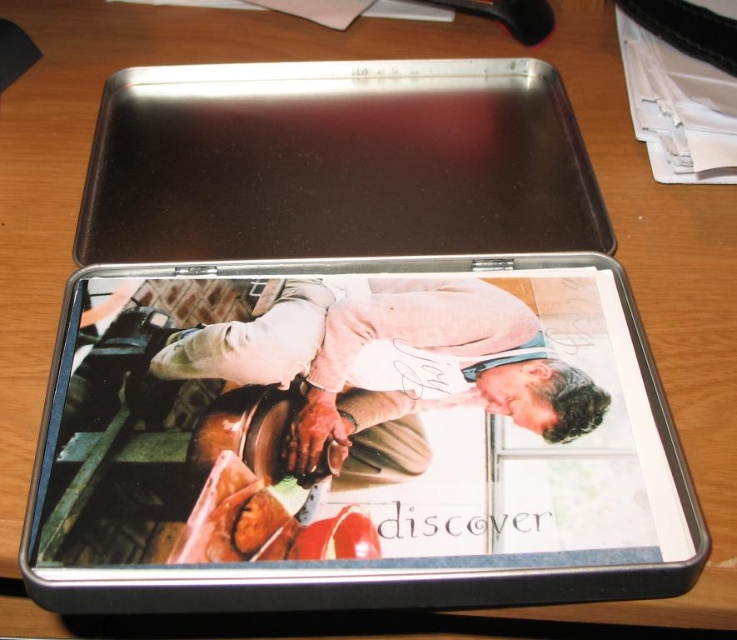
Question: Which object appears closest to the camera in this image?

Choices:
 (A) matte beige sweater at center
 (B) metallic silver tablet at center

Answer: (B)

Question: Can you confirm if metallic silver tablet at center is bigger than metallic silver tray at center?

Choices:
 (A) no
 (B) yes

Answer: (A)

Question: Is metallic silver tablet at center wider than matte beige sweater at center?

Choices:
 (A) yes
 (B) no

Answer: (A)

Question: Which of the following is the farthest from the observer?

Choices:
 (A) (618, 269)
 (B) (517, 364)
 (C) (304, 100)

Answer: (C)

Question: Is metallic silver tablet at center further to the viewer compared to matte beige sweater at center?

Choices:
 (A) yes
 (B) no

Answer: (B)

Question: Which point is farther to the camera?

Choices:
 (A) metallic silver tray at center
 (B) matte beige sweater at center
 (C) metallic silver tablet at center

Answer: (A)